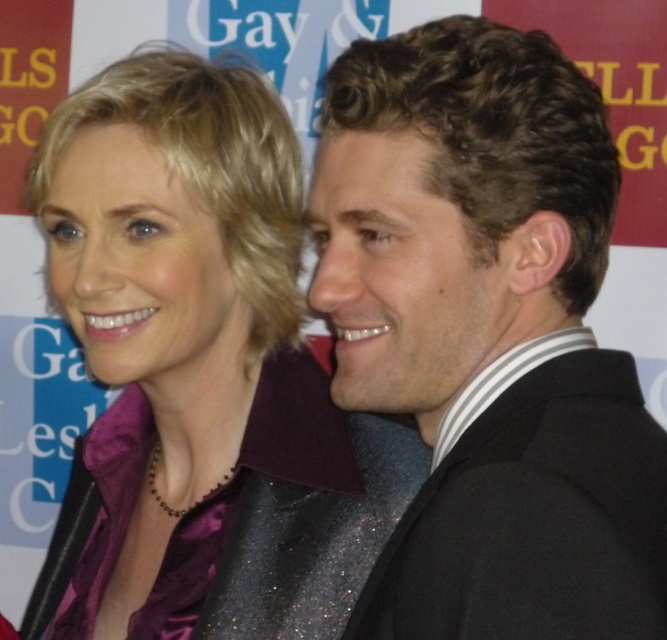
Based on the photo, you are standing at the point with coordinates (548,548) and want to move to the point with coordinates (323,564). According to the image, will you be moving towards the background or the foreground?

Since point (548,548) is in front of point (323,564), moving from point (548,548) to point (323,564) means you are moving towards the background.

Based on the photo, in the scene described, you are standing facing the two individuals. Which object is positioned to the right of the other between the shiny black suit at right and the purple satin blouse at center?

The shiny black suit at right is positioned to the right of the purple satin blouse at center.